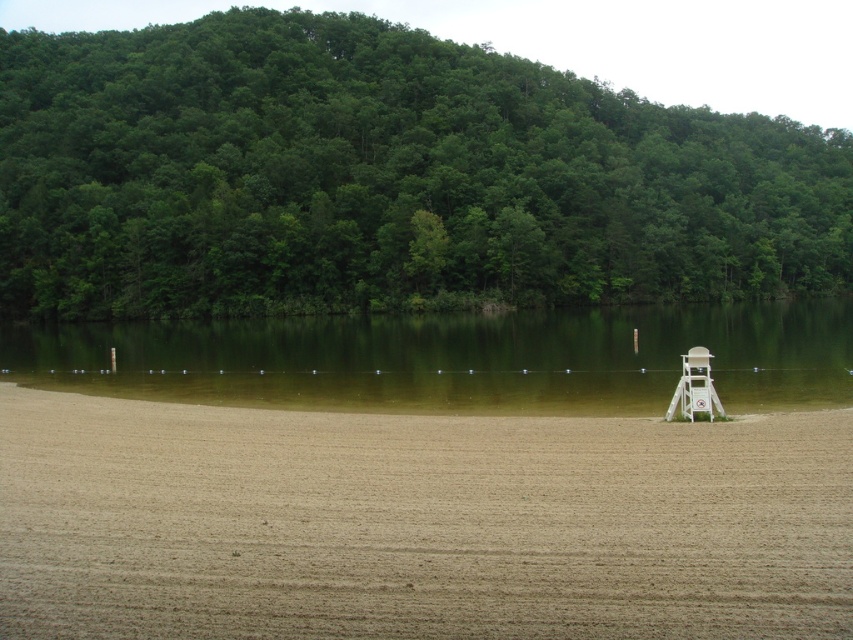
You are standing at the lakeside and looking at two points marked in the image. Which point, point (141, 595) or point (770, 376), is closer to you?

Point (141, 595) is closer to you than point (770, 376).

You are standing on the sandy beach and looking towards the lake. Which object is closer to you, the green leafy trees at upper center or the green smooth water at center?

The green leafy trees at upper center are closer to you because they are positioned further to the viewer than the green smooth water at center.

From the picture: You are standing at the point with coordinates point (805, 561) and want to walk to the point with coordinates point (434, 84). Which direction should you face to move towards your destination?

You should face towards the direction opposite of point (805, 561) to move towards point (434, 84) since it is behind point (805, 561).